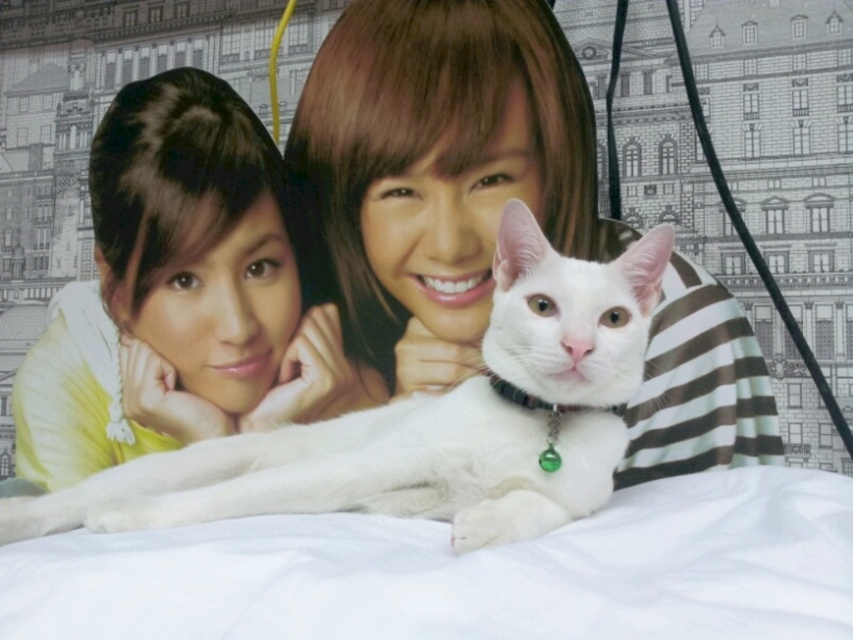
Question: Based on their relative distances, which object is farther from the smooth yellow shirt at upper left?

Choices:
 (A) smooth brown hair at center
 (B) white fur cat at center

Answer: (B)

Question: Does smooth yellow shirt at upper left appear on the left side of white fur cat at center?

Choices:
 (A) yes
 (B) no

Answer: (A)

Question: Which of the following is the farthest from the observer?

Choices:
 (A) (267, 220)
 (B) (563, 285)

Answer: (A)

Question: Can you confirm if smooth yellow shirt at upper left is positioned above white fur cat at center?

Choices:
 (A) no
 (B) yes

Answer: (B)

Question: Does smooth brown hair at center appear under white fur cat at center?

Choices:
 (A) no
 (B) yes

Answer: (A)

Question: Which object is the farthest from the white fur cat at center?

Choices:
 (A) smooth yellow shirt at upper left
 (B) smooth brown hair at center

Answer: (A)